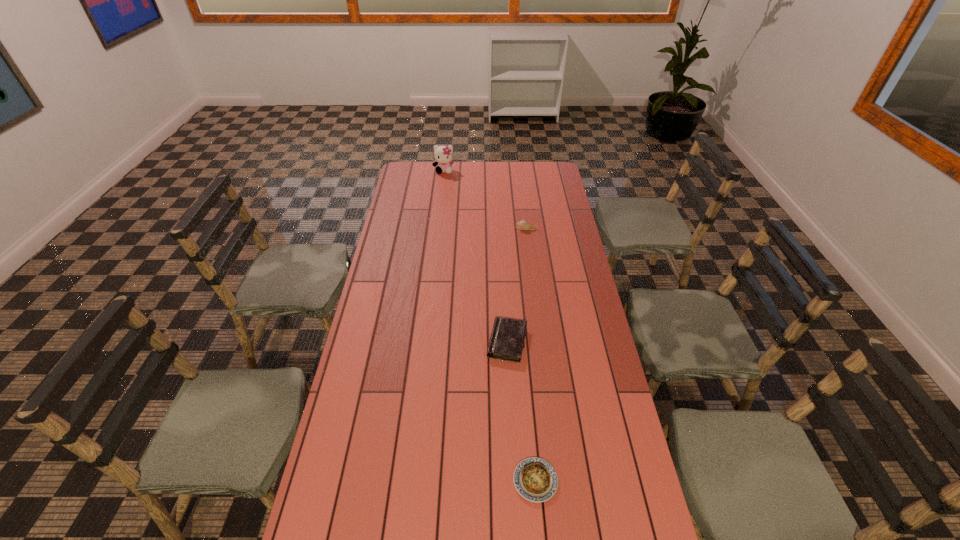
I want to click on free location located on the shell of the third nearest object, so click(498, 229).

In order to click on vacant area located 0.370m on the shell of the third nearest object in this screenshot , I will do `click(435, 229)`.

Find the location of a particular element. The image size is (960, 540). blank space located on the back of the third tallest object is located at coordinates (504, 289).

You are a GUI agent. You are given a task and a screenshot of the screen. Output one action in this format:
    pyautogui.click(x=<x>, y=<y>)
    Task: Click on the free point located 0.270m on the left of the quiche
    Image resolution: width=960 pixels, height=540 pixels.
    Given the screenshot: What is the action you would take?
    pyautogui.click(x=414, y=481)

The image size is (960, 540). What are the coordinates of `object at the far edge` in the screenshot? It's located at (443, 155).

Where is `free space at the far edge`? This screenshot has width=960, height=540. free space at the far edge is located at coordinates (513, 177).

This screenshot has width=960, height=540. Identify the location of free space at the left edge of the desktop. (381, 342).

In order to click on free location at the right edge in this screenshot , I will do `click(583, 308)`.

Locate an element on the screen. The image size is (960, 540). vacant region at the far left corner of the desktop is located at coordinates (404, 175).

At what (x,y) coordinates should I click in order to perform the action: click on vacant space at the far right corner. Please return your answer as a coordinate pair (x, y). This screenshot has height=540, width=960. Looking at the image, I should click on [557, 163].